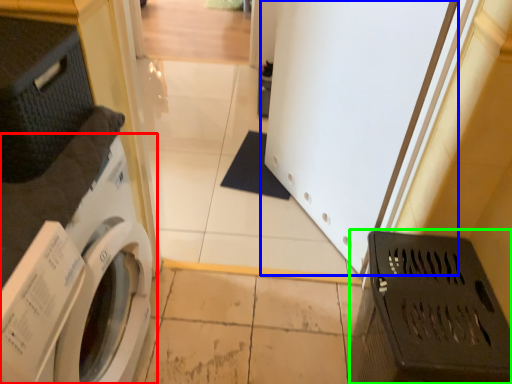
Question: Which object is the closest to the washing machine (highlighted by a red box)? Choose among these: screen door (highlighted by a blue box) or laundry basket (highlighted by a green box).

Choices:
 (A) screen door
 (B) laundry basket

Answer: (B)